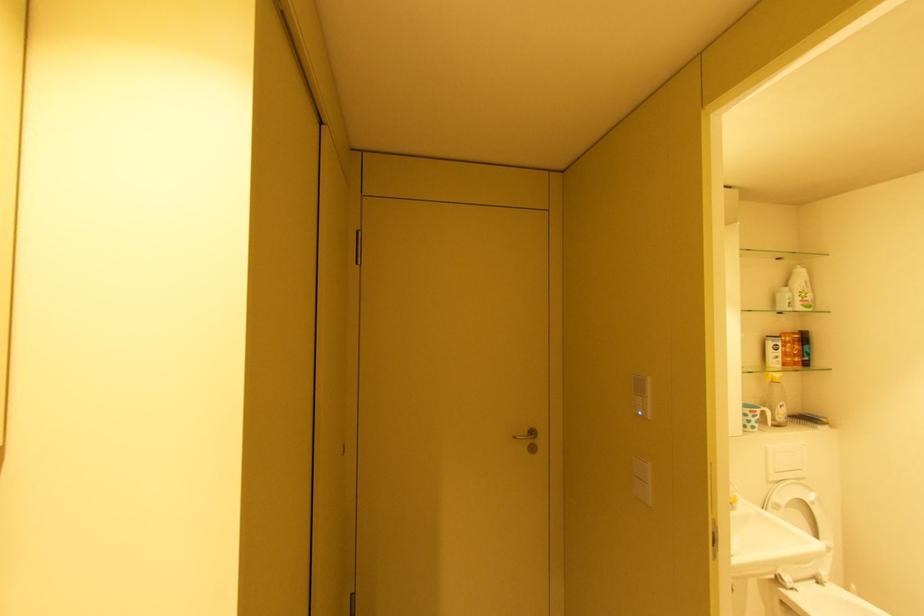
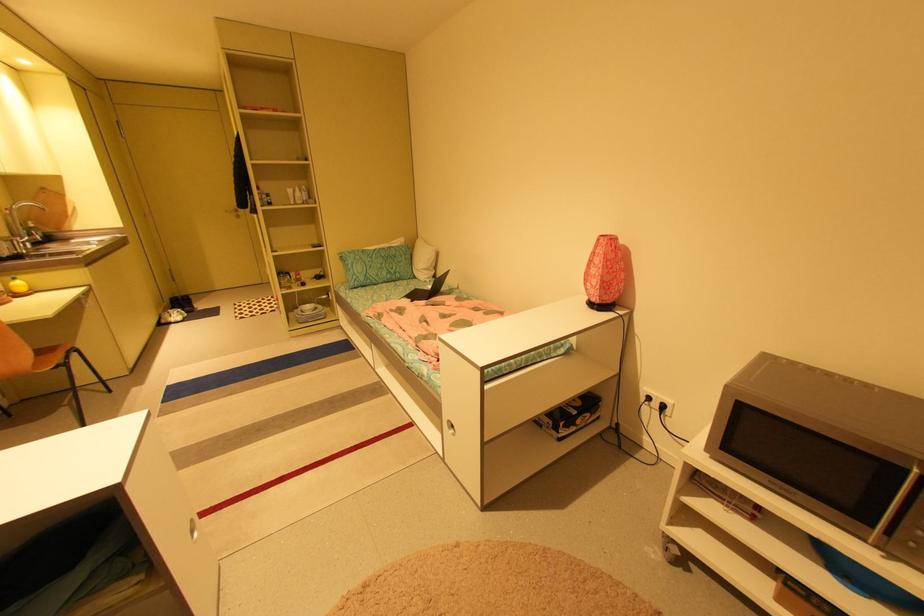
Find the pixel in the second image that matches the point at 520,438 in the first image.

(232, 211)